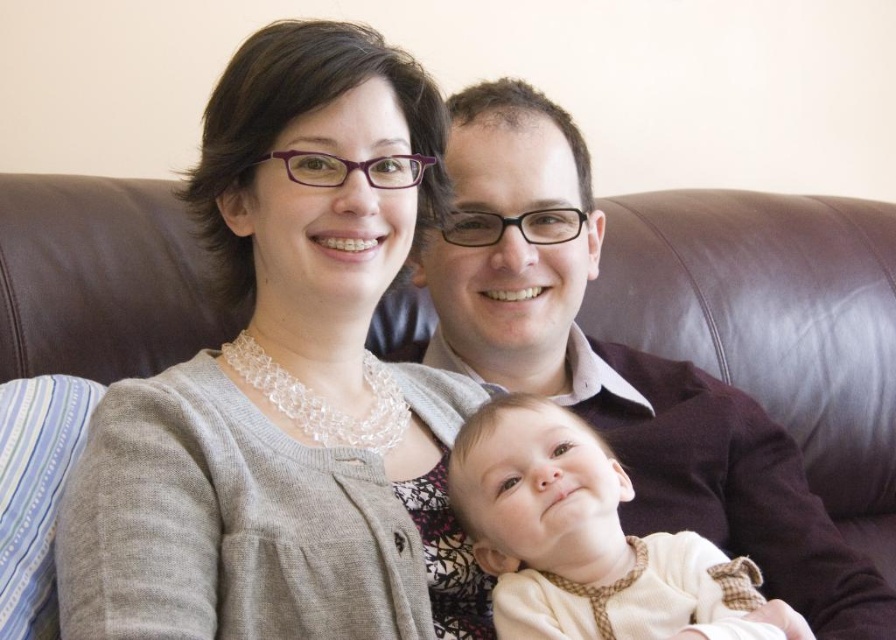
What is the location of the gray knitted sweater at upper left in the image?

The gray knitted sweater at upper left is located at point (x=261, y=518).

You are a photographer taking a portrait of the family. You need to ensure that both the gray knitted sweater at upper left and the light beige soft fabric baby at center are clearly visible in the photo. Given their sizes, which object might require more careful framing to ensure it doesn not get lost in the composition?

The light beige soft fabric baby at center might require more careful framing because it is smaller in size compared to the gray knitted sweater at upper left, making it easier to get lost in the composition if not properly highlighted.

You are a furniture designer evaluating the space requirements for a new sofa. You observe the matte brown leather couch at center and the light beige soft fabric baby at center. Which object has a greater width?

The matte brown leather couch at center has a greater width than the light beige soft fabric baby at center.